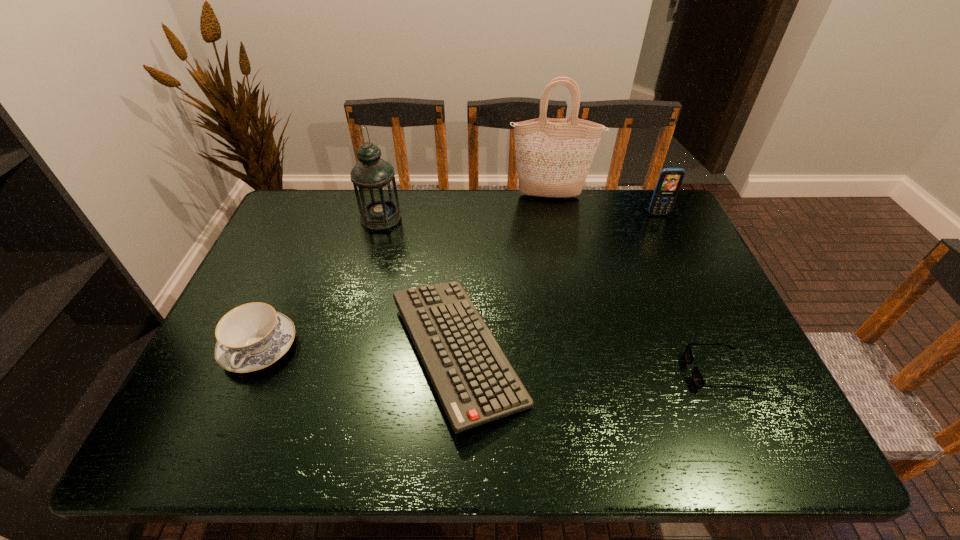
Identify the location of the farthest object. This screenshot has height=540, width=960. click(x=553, y=156).

Identify the location of shopping bag. Image resolution: width=960 pixels, height=540 pixels. (553, 156).

At what (x,y) coordinates should I click in order to perform the action: click on oil lamp. Please return your answer as a coordinate pair (x, y). The height and width of the screenshot is (540, 960). Looking at the image, I should click on (373, 179).

This screenshot has height=540, width=960. I want to click on the fifth shortest object, so click(x=373, y=179).

The image size is (960, 540). Find the location of `the third tallest object`. the third tallest object is located at coordinates (669, 181).

Identify the location of the fourth tallest object. This screenshot has height=540, width=960. (250, 337).

Identify the location of chinaware. (250, 337).

Find the location of `computer keyboard`. computer keyboard is located at coordinates (476, 384).

This screenshot has height=540, width=960. In order to click on the shortest object in this screenshot , I will do `click(697, 378)`.

Where is `vacant space located 0.310m on the left of the tallest object`? This screenshot has width=960, height=540. vacant space located 0.310m on the left of the tallest object is located at coordinates (417, 196).